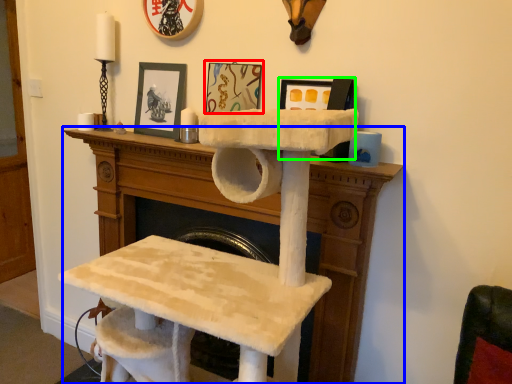
Question: Which is nearer to the picture frame (highlighted by a red box)? furniture (highlighted by a blue box) or picture frame (highlighted by a green box).

Choices:
 (A) furniture
 (B) picture frame

Answer: (B)